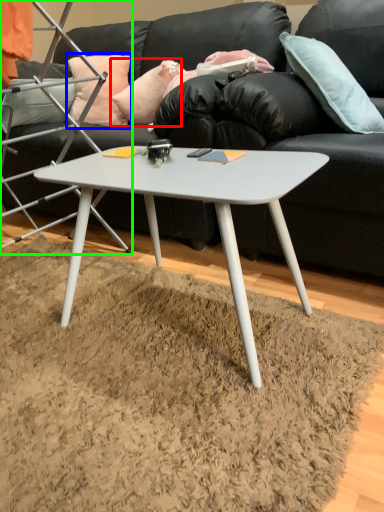
Question: Considering the real-world distances, which object is farthest from pillow (highlighted by a red box)? pillow (highlighted by a blue box) or chair (highlighted by a green box)?

Choices:
 (A) pillow
 (B) chair

Answer: (B)